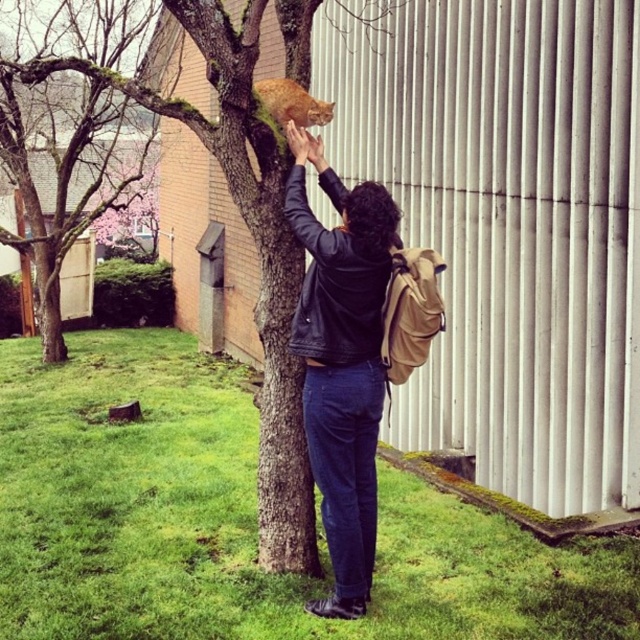
You are a photographer trying to capture a clear shot of the black leather jacket at center and the green mossy tree at upper left. Which object should you focus on first to ensure both are in focus?

You should focus on the black leather jacket at center first because it is closer to the viewer than the green mossy tree at upper left, so adjusting focus from near to far will help both be in focus.

From the picture: You are trying to locate the person in the scene. Where is the black leather jacket at center positioned in relation to the tree and the building?

The black leather jacket at center is positioned closer to the tree than the building, as it is located at point (x=340, y=362) which is nearer to the tree compared to the building in the background.

You are a hiker who wants to take a photo of the green mossy tree at upper left. You are currently standing at point (65, 125). Which direction should you move to get a better view of the tree?

The green mossy tree at upper left is located at point (65, 125), so you are already at the optimal position to take a photo of it.